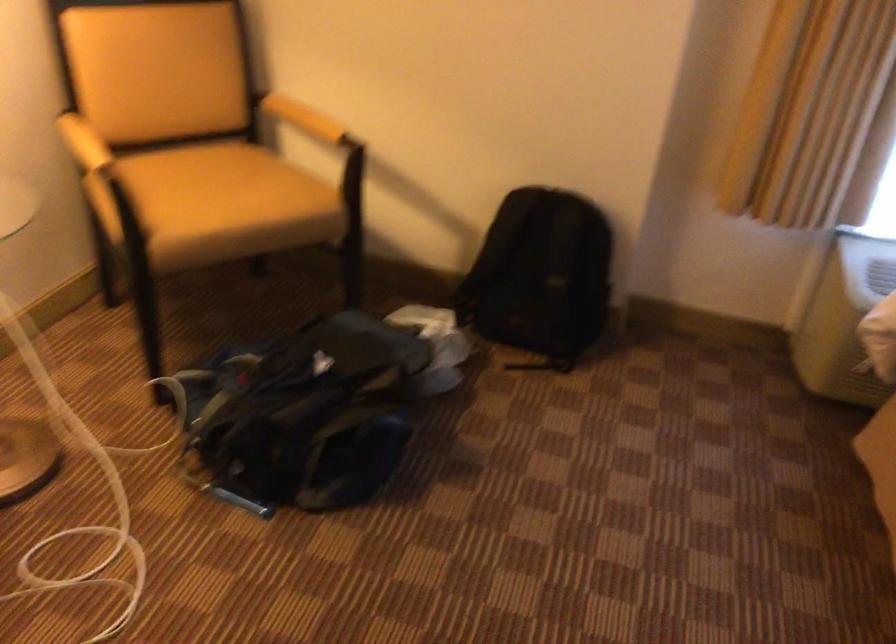
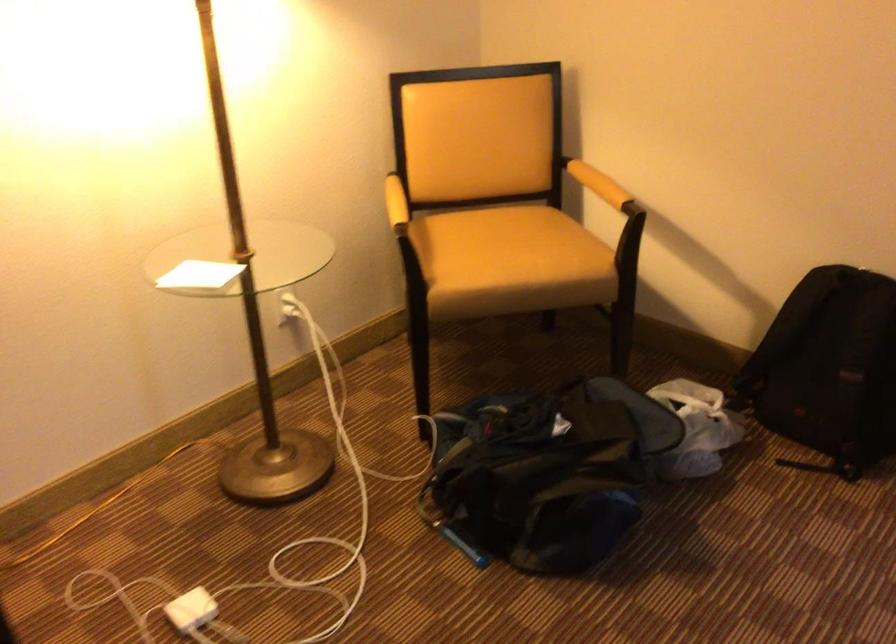
Find the pixel in the second image that matches (99,138) in the first image.

(395, 203)